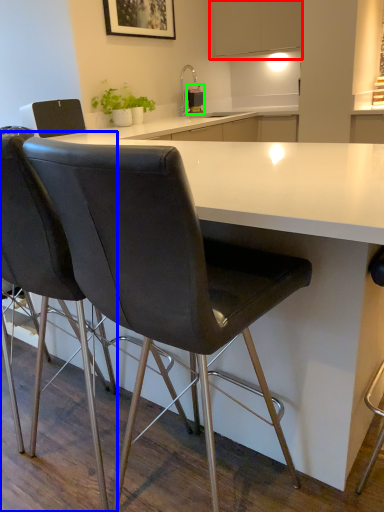
Question: Based on their relative distances, which object is nearer to cabinetry (highlighted by a red box)? Choose from chair (highlighted by a blue box) and kitchen appliance (highlighted by a green box).

Choices:
 (A) chair
 (B) kitchen appliance

Answer: (B)